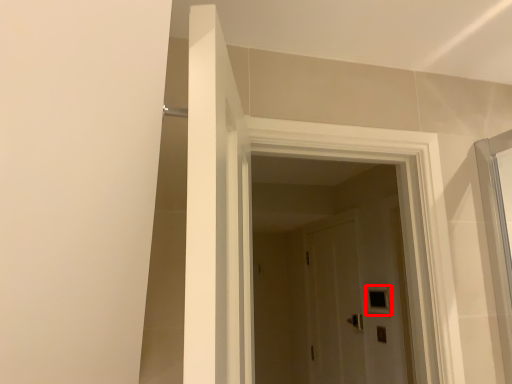
Question: From the image's perspective, where is window (annotated by the red box) located relative to door?

Choices:
 (A) below
 (B) above

Answer: (A)